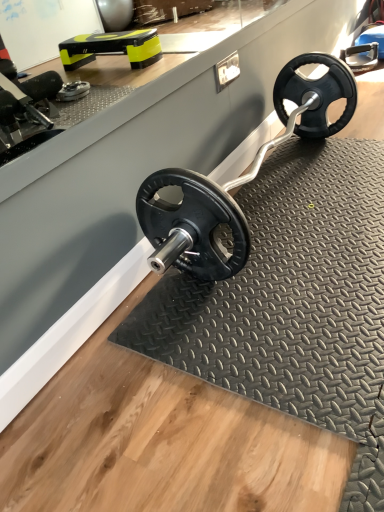
Identify the location of free space in front of black rubber weight plate at center. (263, 325).